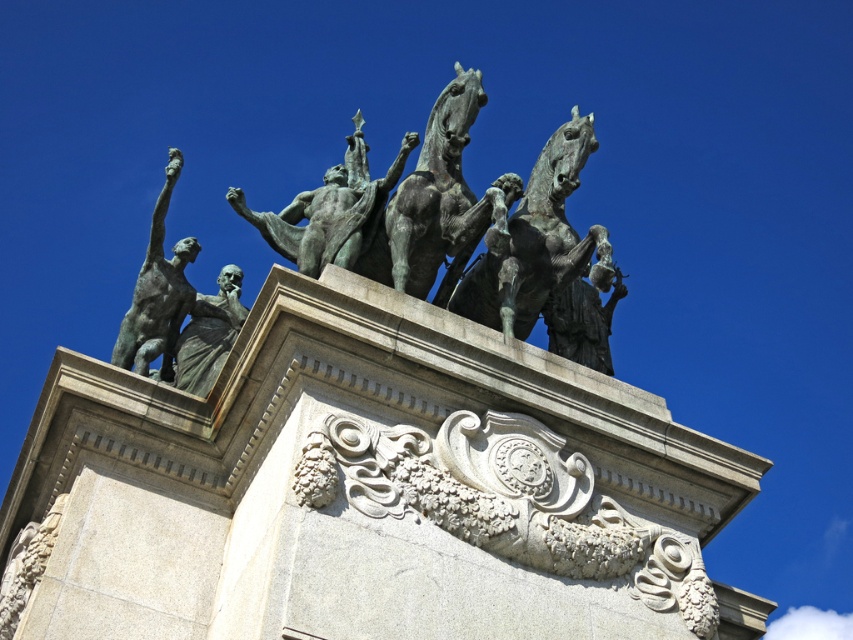
From the picture: Who is positioned more to the left, bronze horse at upper center or bronze/greenish patina horse at center?

Positioned to the left is bronze/greenish patina horse at center.

Is bronze horse at upper center below bronze/greenish patina horse at center?

Yes, bronze horse at upper center is below bronze/greenish patina horse at center.

This screenshot has width=853, height=640. Identify the location of bronze horse at upper center. [x=547, y=260].

Does bronze/greenish patina horse at center have a greater width compared to bronze statue at center?

In fact, bronze/greenish patina horse at center might be narrower than bronze statue at center.

Who is higher up, bronze/greenish patina horse at center or bronze statue at center?

Positioned higher is bronze/greenish patina horse at center.

Is point (419, 182) positioned after point (276, 248)?

No, (419, 182) is in front of (276, 248).

Locate an element on the screen. Image resolution: width=853 pixels, height=640 pixels. bronze/greenish patina horse at center is located at coordinates (442, 198).

Between bronze horse at upper center and bronze statue at center, which one has more height?

Standing taller between the two is bronze horse at upper center.

Is bronze horse at upper center shorter than bronze statue at center?

In fact, bronze horse at upper center may be taller than bronze statue at center.

Find the location of a particular element. This screenshot has width=853, height=640. bronze horse at upper center is located at coordinates (547, 260).